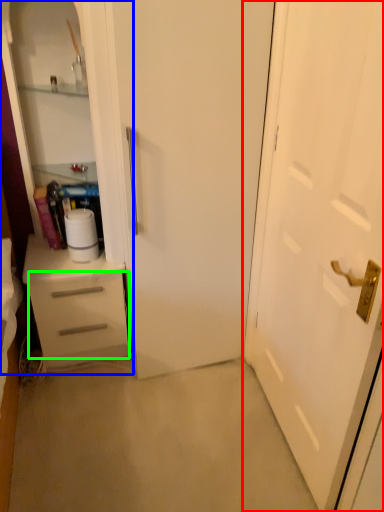
Question: Based on their relative distances, which object is nearer to door (highlighted by a red box)? Choose from dresser (highlighted by a blue box) and drawer (highlighted by a green box).

Choices:
 (A) dresser
 (B) drawer

Answer: (A)